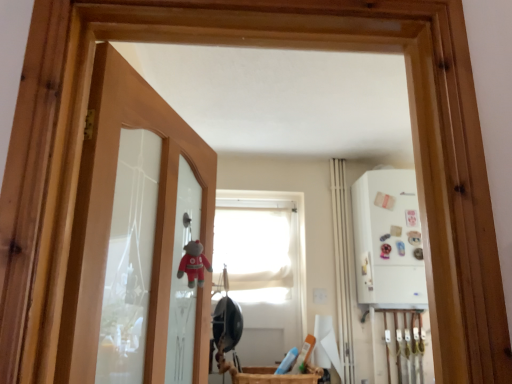
Question: Does translucent glass door at left have a lesser height compared to white matte window at center?

Choices:
 (A) no
 (B) yes

Answer: (B)

Question: Is the depth of translucent glass door at left less than that of white matte window at center?

Choices:
 (A) no
 (B) yes

Answer: (B)

Question: Are translucent glass door at left and white matte window at center beside each other?

Choices:
 (A) no
 (B) yes

Answer: (A)

Question: Would you say translucent glass door at left is outside white matte window at center?

Choices:
 (A) yes
 (B) no

Answer: (A)

Question: From the image's perspective, would you say translucent glass door at left is shown under white matte window at center?

Choices:
 (A) no
 (B) yes

Answer: (A)

Question: Can you confirm if translucent glass door at left is thinner than white matte window at center?

Choices:
 (A) no
 (B) yes

Answer: (A)

Question: Does wooden basket at lower center have a lesser width compared to translucent glass door at left?

Choices:
 (A) yes
 (B) no

Answer: (B)

Question: From a real-world perspective, is wooden basket at lower center positioned under translucent glass door at left based on gravity?

Choices:
 (A) no
 (B) yes

Answer: (B)

Question: Is wooden basket at lower center turned away from translucent glass door at left?

Choices:
 (A) yes
 (B) no

Answer: (B)

Question: Is wooden basket at lower center bigger than translucent glass door at left?

Choices:
 (A) yes
 (B) no

Answer: (B)

Question: From the image's perspective, is wooden basket at lower center above translucent glass door at left?

Choices:
 (A) no
 (B) yes

Answer: (A)

Question: Is wooden basket at lower center closer to camera compared to translucent glass door at left?

Choices:
 (A) no
 (B) yes

Answer: (A)

Question: From a real-world perspective, is white glossy medicine cabinet at right on top of white fabric curtain at center-right?

Choices:
 (A) yes
 (B) no

Answer: (A)